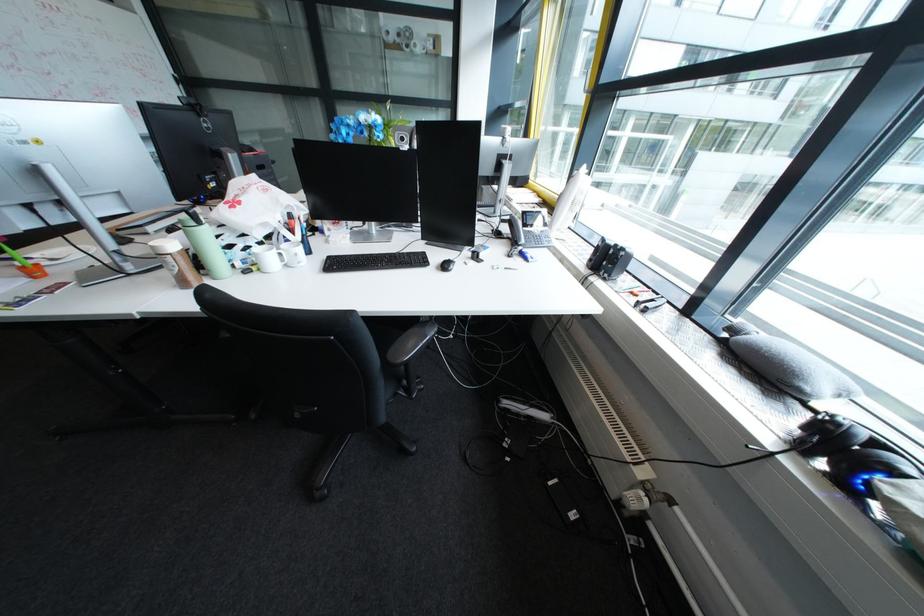
Find where to sit the chair sitting surface. Please return your answer as a coordinate pair (x, y).

(410, 342)